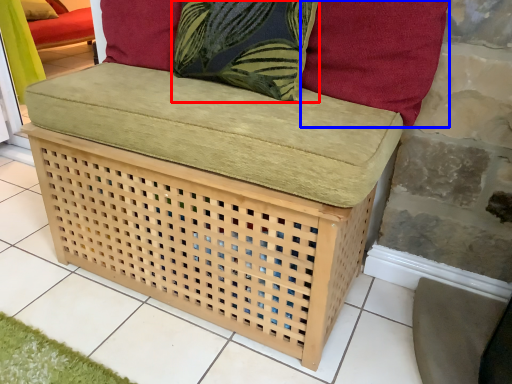
Question: Among these objects, which one is farthest to the camera, throw pillow (highlighted by a red box) or pillow (highlighted by a blue box)?

Choices:
 (A) throw pillow
 (B) pillow

Answer: (A)